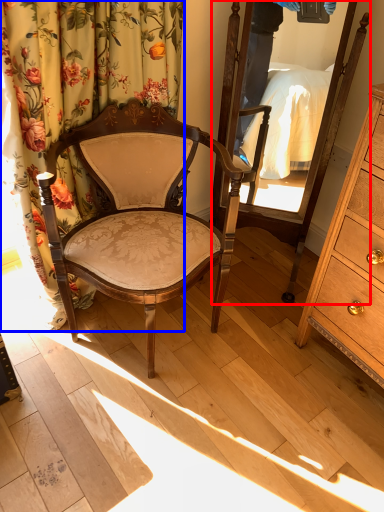
Question: Which object appears farthest to the camera in this image, mirror (highlighted by a red box) or curtain (highlighted by a blue box)?

Choices:
 (A) mirror
 (B) curtain

Answer: (A)